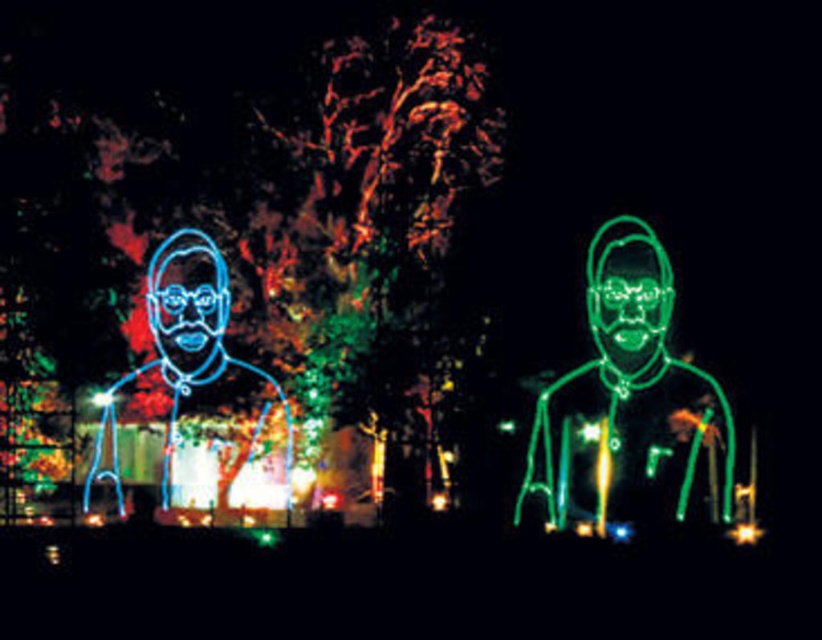
Question: From the image, what is the correct spatial relationship of neon green wireframe figure at center in relation to neon green face at center?

Choices:
 (A) right
 (B) left

Answer: (B)

Question: Which of these objects is positioned farthest from the blue neon sign at left?

Choices:
 (A) neon green face at center
 (B) neon blue face at left

Answer: (A)

Question: Which of the following is the farthest from the observer?

Choices:
 (A) (169, 326)
 (B) (642, 301)
 (C) (590, 291)

Answer: (A)

Question: Which is nearer to the neon blue face at left?

Choices:
 (A) blue neon sign at left
 (B) neon green face at center
 (C) neon green wireframe figure at center

Answer: (A)

Question: Is neon green face at center closer to the viewer compared to neon blue face at left?

Choices:
 (A) no
 (B) yes

Answer: (B)

Question: Is neon green wireframe figure at center thinner than neon green face at center?

Choices:
 (A) yes
 (B) no

Answer: (B)